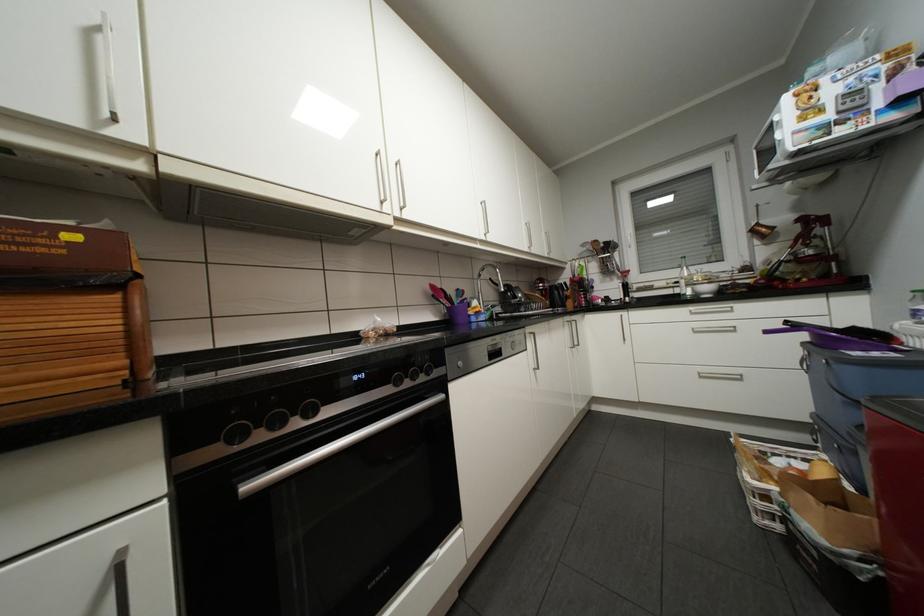
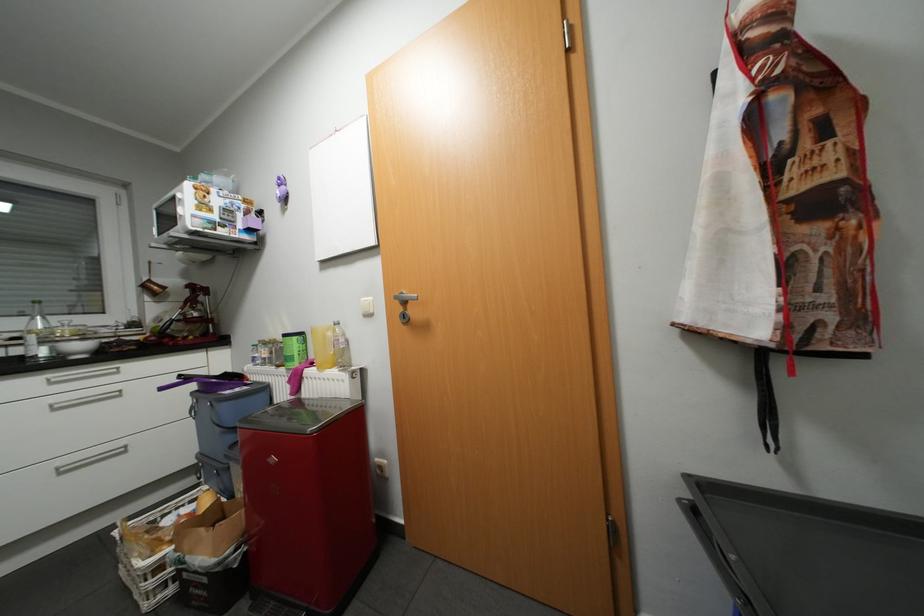
Where in the second image is the point corresponding to [766,519] from the first image?

(156, 604)